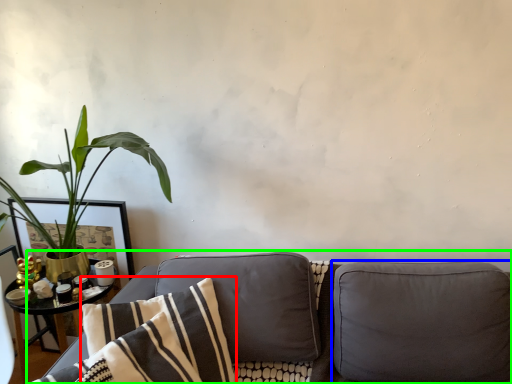
Question: Based on their relative distances, which object is farther from pillow (highlighted by a red box)? Choose from pillow (highlighted by a blue box) and studio couch (highlighted by a green box).

Choices:
 (A) pillow
 (B) studio couch

Answer: (A)